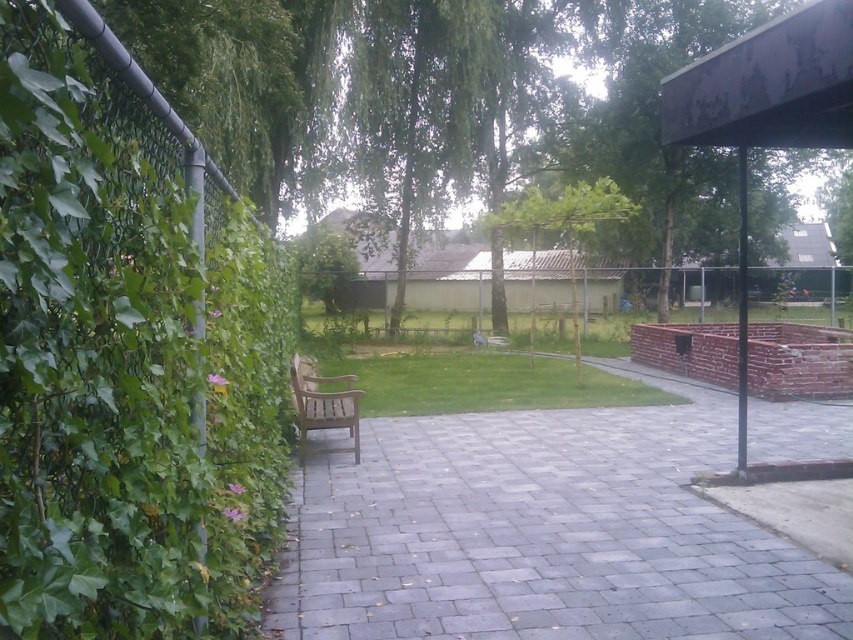
Question: Where is gray stone path at center located in relation to green leafy tree at upper right in the image?

Choices:
 (A) left
 (B) right

Answer: (A)

Question: In this image, where is green leafy hedge at left located relative to green leafy tree at upper right?

Choices:
 (A) above
 (B) below

Answer: (B)

Question: Which object is positioned farthest from the wooden bench at center?

Choices:
 (A) gray stone path at center
 (B) green leafy hedge at left
 (C) green leafy tree at upper right

Answer: (C)

Question: Which object is farther from the camera taking this photo?

Choices:
 (A) green leafy hedge at left
 (B) green leafy tree at upper right

Answer: (B)

Question: Which point is closer to the camera taking this photo?

Choices:
 (A) (67, 116)
 (B) (604, 49)
 (C) (660, 625)
 (D) (328, 380)

Answer: (A)

Question: Can you confirm if green leafy hedge at left is positioned to the right of wooden bench at center?

Choices:
 (A) yes
 (B) no

Answer: (A)